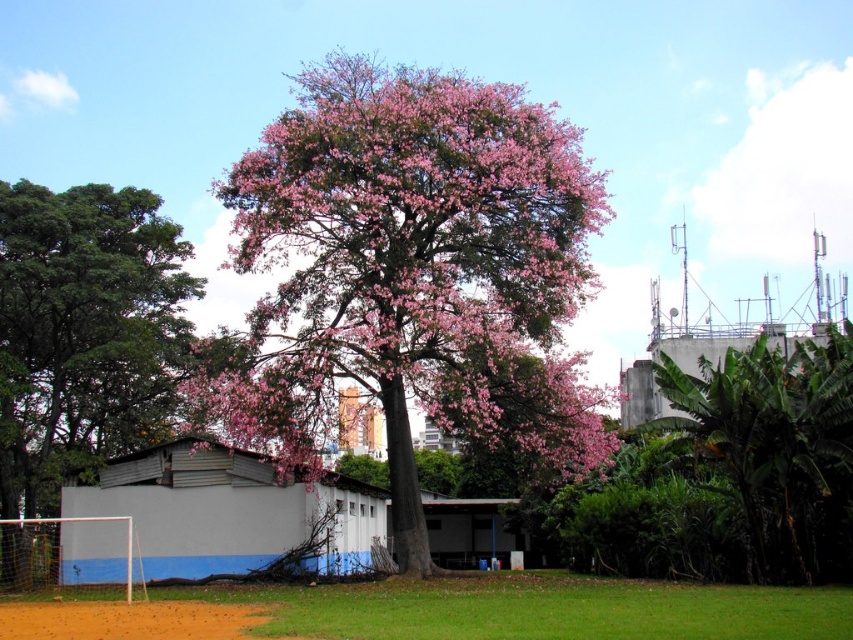
Question: Which point appears closest to the camera in this image?

Choices:
 (A) (752, 492)
 (B) (318, 200)
 (C) (262, 616)
 (D) (163, 388)

Answer: (C)

Question: Among these points, which one is farthest from the camera?

Choices:
 (A) (311, 348)
 (B) (637, 621)

Answer: (A)

Question: Does brown dirt field at lower left have a lesser width compared to green leafy tree at right?

Choices:
 (A) yes
 (B) no

Answer: (B)

Question: Can you confirm if green leafy tree at right is positioned to the left of brown sandy dirt field at lower left?

Choices:
 (A) yes
 (B) no

Answer: (B)

Question: Does green leafy tree at left appear under green leafy tree at right?

Choices:
 (A) no
 (B) yes

Answer: (A)

Question: Estimate the real-world distances between objects in this image. Which object is closer to the brown dirt field at lower left?

Choices:
 (A) green leafy tree at left
 (B) green leafy tree at right
 (C) pink matte tree at center

Answer: (B)